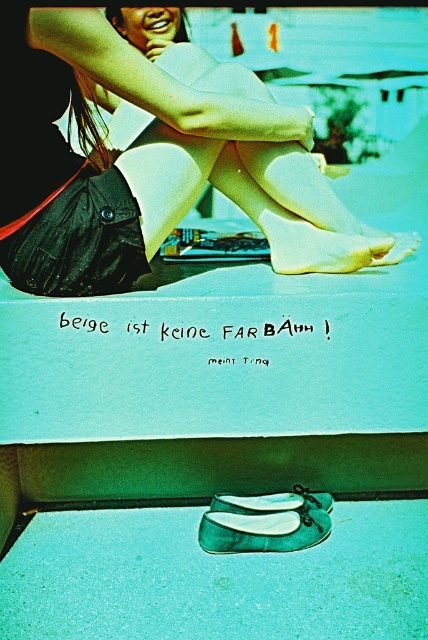
Question: Which object is positioned farthest from the matte black bag at lower left?

Choices:
 (A) matte green shoe at lower center
 (B) green leather shoes at lower center

Answer: (A)

Question: From the image, what is the correct spatial relationship of matte black bag at lower left in relation to matte green shoe at lower center?

Choices:
 (A) below
 (B) above

Answer: (B)

Question: Does matte black bag at lower left appear under matte green shoe at lower center?

Choices:
 (A) no
 (B) yes

Answer: (A)

Question: In this image, where is green leather shoes at lower center located relative to matte green shoe at lower center?

Choices:
 (A) above
 (B) below

Answer: (B)

Question: Which of these objects is positioned farthest from the matte green shoe at lower center?

Choices:
 (A) matte black bag at lower left
 (B) green leather shoes at lower center

Answer: (A)

Question: Which point is closer to the camera?

Choices:
 (A) matte green shoe at lower center
 (B) green leather shoes at lower center

Answer: (B)